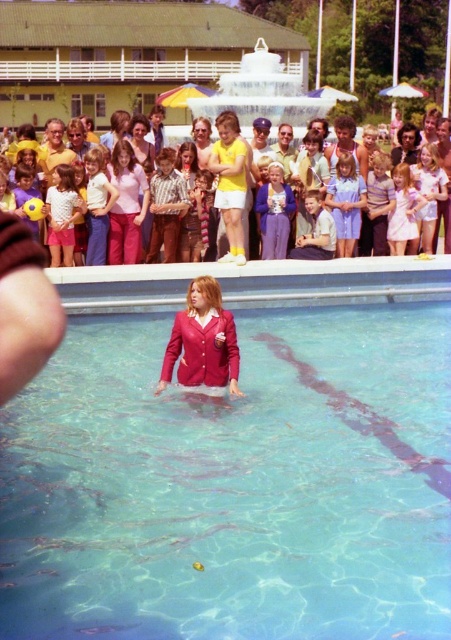
Question: Does light blue cotton dress at center appear under matte yellow shorts at center?

Choices:
 (A) yes
 (B) no

Answer: (A)

Question: Which object is positioned closest to the clear glass water at center?

Choices:
 (A) light blue cotton dress at center
 (B) matte yellow shorts at center

Answer: (A)

Question: Estimate the real-world distances between objects in this image. Which object is closer to the clear glass water at center?

Choices:
 (A) light blue cotton dress at center
 (B) matte yellow shorts at center

Answer: (A)

Question: Is light blue cotton dress at center above matte yellow shorts at center?

Choices:
 (A) no
 (B) yes

Answer: (A)

Question: Does clear glass water at center appear on the right side of matte yellow shorts at center?

Choices:
 (A) yes
 (B) no

Answer: (A)

Question: Estimate the real-world distances between objects in this image. Which object is closer to the light blue cotton dress at center?

Choices:
 (A) matte yellow shorts at center
 (B) clear glass water at center

Answer: (A)